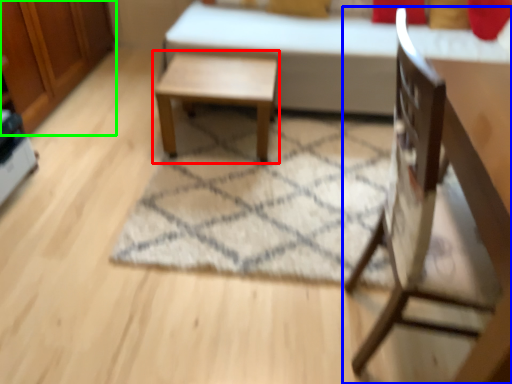
Question: Considering the real-world distances, which object is closest to table (highlighted by a red box)? chair (highlighted by a blue box) or dresser (highlighted by a green box).

Choices:
 (A) chair
 (B) dresser

Answer: (B)